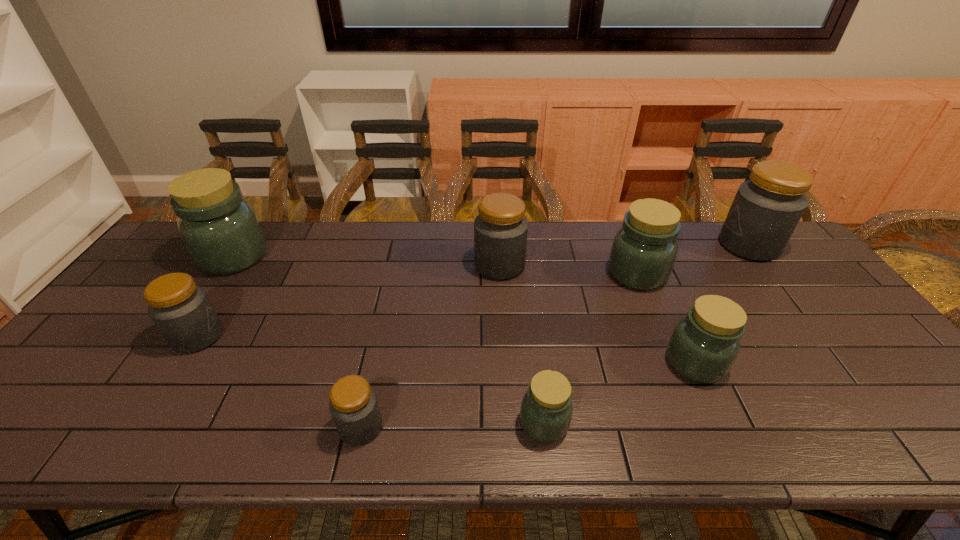
I want to click on vacant space located on the surface of the leftmost gray jar near the warning symbol, so click(x=252, y=336).

Find the location of a particular element. vacant space situated on the front of the second smallest green jar is located at coordinates (728, 435).

At what (x,y) coordinates should I click in order to perform the action: click on vacant space located on the surface of the smallest gray jar near the warning symbol. Please return your answer as a coordinate pair (x, y). The width and height of the screenshot is (960, 540). Looking at the image, I should click on click(x=549, y=427).

Find the location of a particular element. The image size is (960, 540). vacant region located 0.140m on the right of the second green jar from left to right is located at coordinates (633, 423).

The width and height of the screenshot is (960, 540). In order to click on object situated at the left edge in this screenshot , I will do `click(221, 231)`.

At what (x,y) coordinates should I click in order to perform the action: click on object that is at the right edge. Please return your answer as a coordinate pair (x, y). Looking at the image, I should click on (766, 209).

The height and width of the screenshot is (540, 960). I want to click on object at the far left corner, so click(221, 231).

Where is `object present at the far right corner`? object present at the far right corner is located at coordinates (766, 209).

I want to click on free space at the far edge, so click(553, 225).

Where is `free space at the near edge of the desktop`? The height and width of the screenshot is (540, 960). free space at the near edge of the desktop is located at coordinates (158, 428).